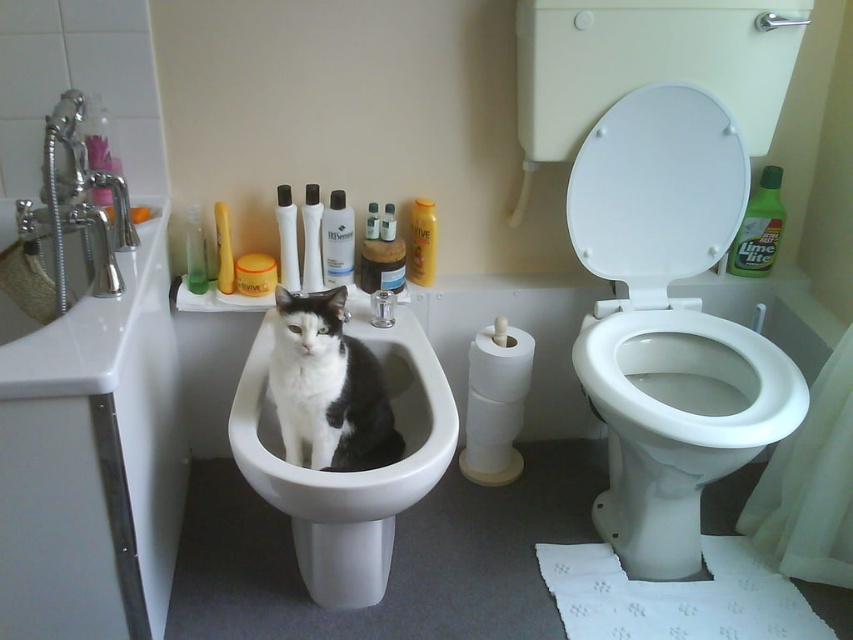
You are a cleaning robot with a height of 1.5 meters. You need to clean the white glossy toilet lid at upper right. Can you reach it without any assistance?

The white glossy toilet lid at upper right is 1.44 meters away from the camera. Since the robot is 1.5 meters tall, it can reach the lid as its height exceeds the distance to the lid.

You are a person who just entered the bathroom and need to reach the white matte toilet paper at lower center. Considering your height is 5 feet 6 inches, can you comfortably reach it without needing to stand on your toes?

The distance between you and the white matte toilet paper at lower center is 5.25 feet. Since the average comfortable reaching distance for someone 5 feet 6 inches tall is around 5 feet, you can comfortably reach it without needing to stand on your toes.

You are standing in the bathroom and want to reach both points. Which point, point (465, 458) or point (221, 291), is closer to you?

Point (465, 458) is closer to you because it is further to the viewer than point (221, 291).